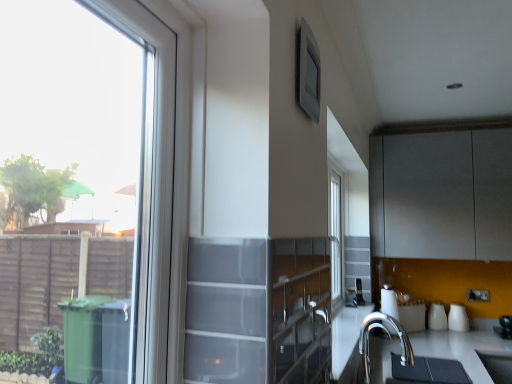
Question: Considering the relative sizes of clear glass window at left and white glossy vase at right, marked as the first appliance in a right-to-left arrangement, in the image provided, is clear glass window at left smaller than white glossy vase at right, marked as the first appliance in a right-to-left arrangement,?

Choices:
 (A) no
 (B) yes

Answer: (A)

Question: From the image's perspective, is clear glass window at left under white glossy vase at right, the 3th appliance when ordered from left to right?

Choices:
 (A) no
 (B) yes

Answer: (A)

Question: Is clear glass window at left taller than white glossy vase at right, the 3th appliance when ordered from left to right?

Choices:
 (A) yes
 (B) no

Answer: (A)

Question: Is clear glass window at left to the right of white glossy vase at right, the 3th appliance when ordered from left to right, from the viewer's perspective?

Choices:
 (A) yes
 (B) no

Answer: (B)

Question: From a real-world perspective, is clear glass window at left physically above white glossy vase at right, marked as the first appliance in a right-to-left arrangement?

Choices:
 (A) no
 (B) yes

Answer: (B)

Question: In the image, is matte gray cabinet at upper right positioned in front of or behind satin silver toaster at lower center, which is the 1th appliance from left to right?

Choices:
 (A) behind
 (B) front

Answer: (B)

Question: Considering the relative positions of matte gray cabinet at upper right and satin silver toaster at lower center, which is the 1th appliance from left to right, in the image provided, is matte gray cabinet at upper right to the left or to the right of satin silver toaster at lower center, which is the 1th appliance from left to right,?

Choices:
 (A) left
 (B) right

Answer: (B)

Question: Looking at the image, does matte gray cabinet at upper right seem bigger or smaller compared to satin silver toaster at lower center, which is the 1th appliance from left to right?

Choices:
 (A) big
 (B) small

Answer: (A)

Question: Considering the positions of matte gray cabinet at upper right and satin silver toaster at lower center, acting as the 3th appliance starting from the right, in the image, is matte gray cabinet at upper right wider or thinner than satin silver toaster at lower center, acting as the 3th appliance starting from the right,?

Choices:
 (A) wide
 (B) thin

Answer: (A)

Question: Is matte gray cabinet at upper right wider or thinner than clear glass window at left?

Choices:
 (A) wide
 (B) thin

Answer: (A)

Question: From the image's perspective, is matte gray cabinet at upper right located above or below clear glass window at left?

Choices:
 (A) above
 (B) below

Answer: (B)

Question: Is point (482, 192) positioned closer to the camera than point (90, 246)?

Choices:
 (A) closer
 (B) farther

Answer: (B)

Question: Is matte gray cabinet at upper right spatially inside clear glass window at left, or outside of it?

Choices:
 (A) outside
 (B) inside

Answer: (A)

Question: Relative to matte gray window screen at upper center, is polished chrome faucet at lower right in front or behind?

Choices:
 (A) front
 (B) behind

Answer: (B)

Question: In terms of size, does polished chrome faucet at lower right appear bigger or smaller than matte gray window screen at upper center?

Choices:
 (A) big
 (B) small

Answer: (A)